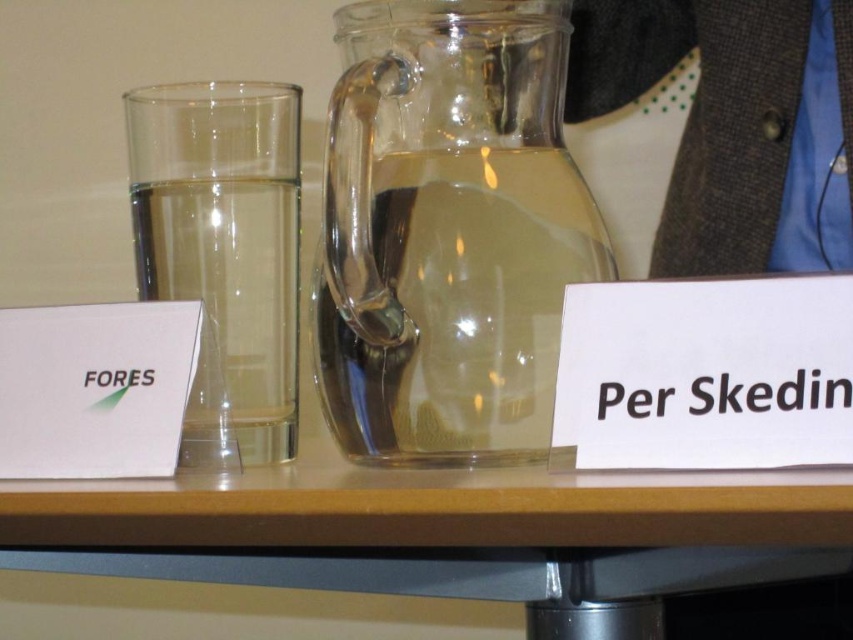
Question: Among these points, which one is nearest to the camera?

Choices:
 (A) (146, 381)
 (B) (576, 568)
 (C) (759, 394)
 (D) (491, 108)

Answer: (C)

Question: Among these points, which one is farthest from the camera?

Choices:
 (A) (242, 154)
 (B) (483, 468)
 (C) (717, 388)

Answer: (A)

Question: Can you confirm if transparent glass jug at center is bigger than green paper at left?

Choices:
 (A) no
 (B) yes

Answer: (B)

Question: Does transparent glass jug at center appear on the left side of transparent glass table at center?

Choices:
 (A) yes
 (B) no

Answer: (B)

Question: Which point is closer to the camera?

Choices:
 (A) green paper at left
 (B) transparent glass table at center
 (C) transparent glass jug at center
 (D) black paper at right

Answer: (B)

Question: Can you confirm if clear glass pitcher at center is thinner than green paper at left?

Choices:
 (A) yes
 (B) no

Answer: (B)